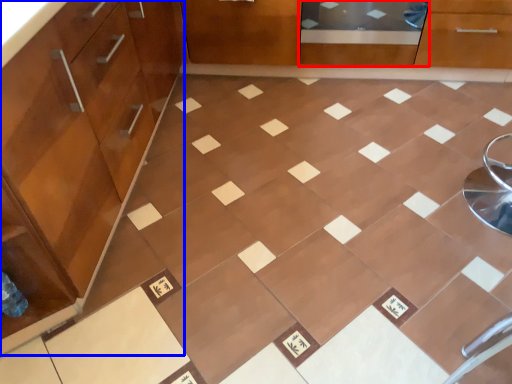
Question: Which object is closer to the camera taking this photo, screen door (highlighted by a red box) or cabinetry (highlighted by a blue box)?

Choices:
 (A) screen door
 (B) cabinetry

Answer: (B)